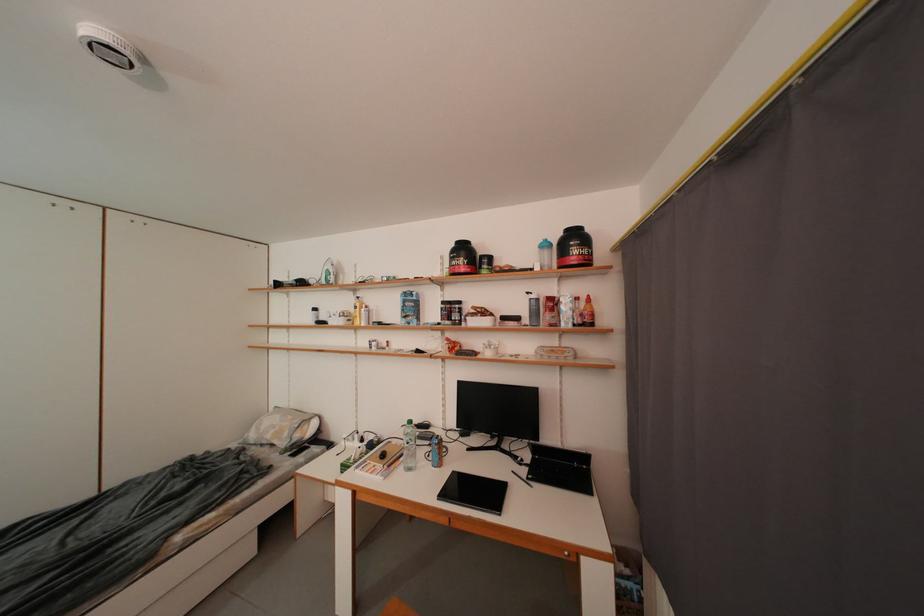
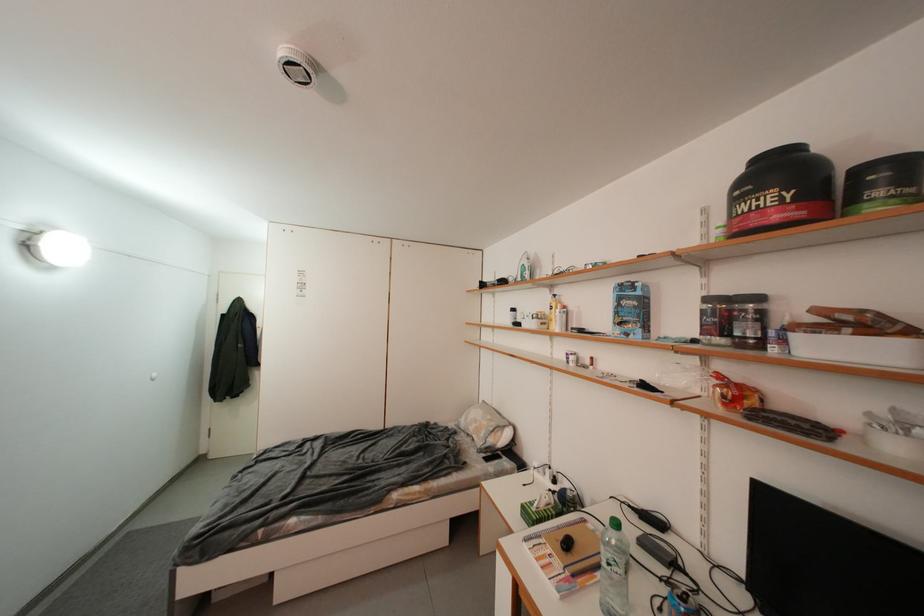
In the second image, find the point that corresponds to pixel 409 462 in the first image.

(606, 578)